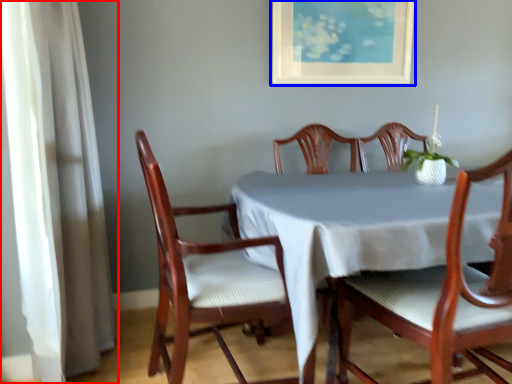
Question: Which of the following is the farthest to the observer, curtain (highlighted by a red box) or picture frame (highlighted by a blue box)?

Choices:
 (A) curtain
 (B) picture frame

Answer: (B)